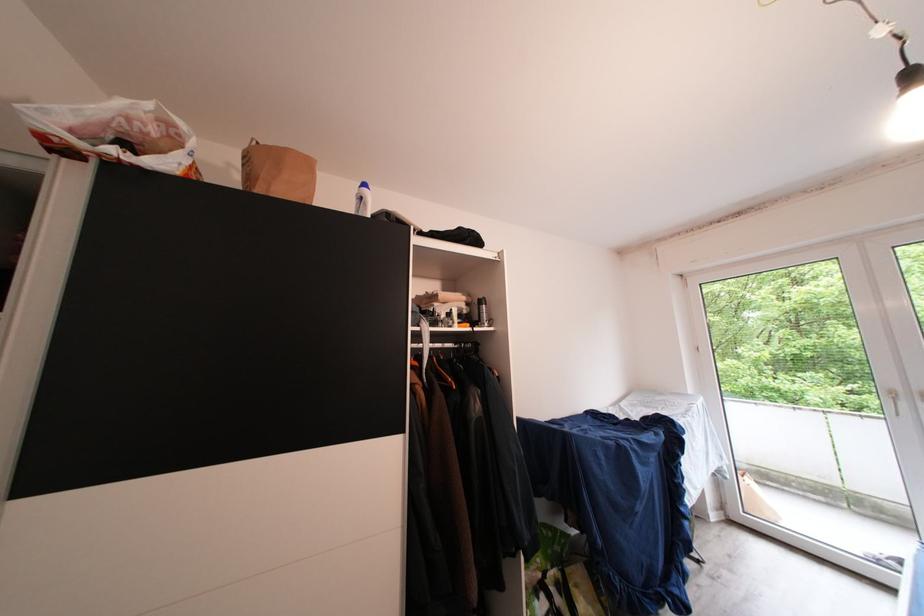
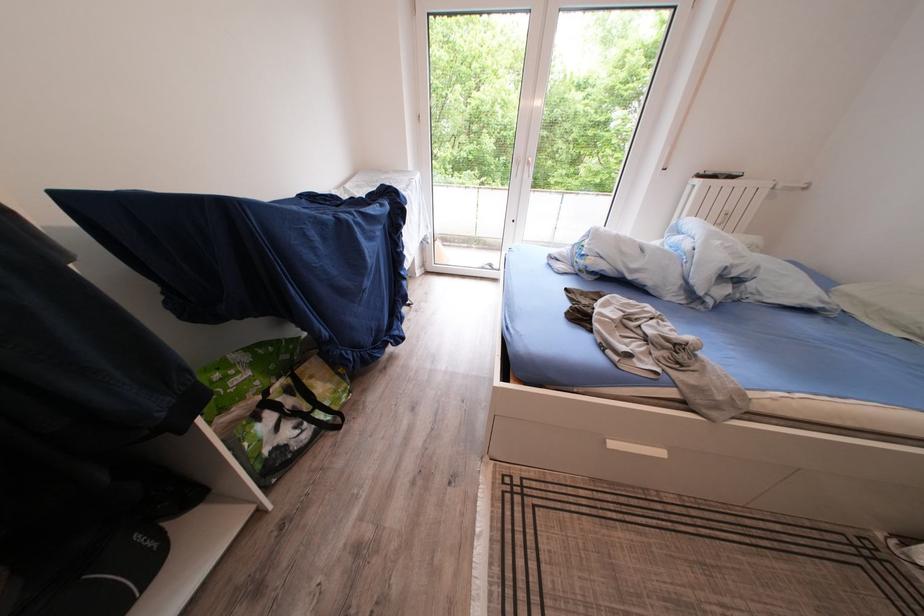
The images are taken continuously from a first-person perspective. In which direction is your viewpoint rotating?

The rotation direction of the camera is right-down.